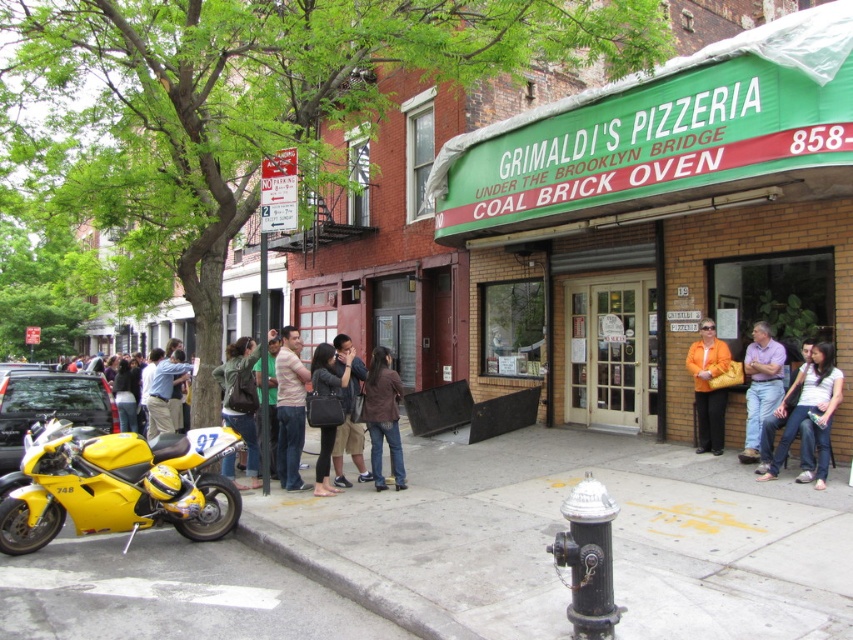
Question: Among these objects, which one is nearest to the camera?

Choices:
 (A) matte black jacket at center
 (B) light brown leather jacket at center
 (C) orange fabric bag at center
 (D) denim jacket at center

Answer: (A)

Question: Is the position of denim jeans at lower right more distant than that of light blue shirt at center?

Choices:
 (A) yes
 (B) no

Answer: (B)

Question: Is denim jeans at lower right to the right of light blue shirt at center from the viewer's perspective?

Choices:
 (A) no
 (B) yes

Answer: (B)

Question: Is black metallic fire hydrant at lower center behind pink cotton shirt at center?

Choices:
 (A) yes
 (B) no

Answer: (B)

Question: Which of the following is the closest to the observer?

Choices:
 (A) (746, 392)
 (B) (227, 476)

Answer: (B)

Question: Which object appears farthest from the camera in this image?

Choices:
 (A) purple cotton shirt at center
 (B) light brown leather jacket at center

Answer: (B)